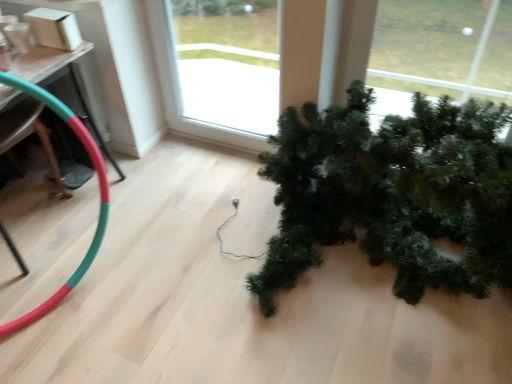
The image size is (512, 384). Describe the element at coordinates (228, 62) in the screenshot. I see `transparent glass window at center` at that location.

The image size is (512, 384). In order to click on green matte christmas tree at lower right in this screenshot , I will do `click(392, 194)`.

This screenshot has height=384, width=512. In order to click on transparent glass window at center in this screenshot , I will do `click(228, 62)`.

From the image's perspective, which one is positioned lower, rubber green and red garden hose at lower left or green matte christmas tree at lower right?

green matte christmas tree at lower right, from the image's perspective.

Is rubber green and red garden hose at lower left positioned beyond the bounds of green matte christmas tree at lower right?

Yes.

Considering the positions of point (56, 112) and point (471, 119), is point (56, 112) closer or farther from the camera than point (471, 119)?

Point (56, 112) is closer to the camera than point (471, 119).

Considering the relative sizes of rubber green and red garden hose at lower left and green matte christmas tree at lower right in the image provided, is rubber green and red garden hose at lower left bigger than green matte christmas tree at lower right?

No.

I want to click on window that appears above the rubber green and red garden hose at lower left (from the image's perspective), so click(x=228, y=62).

In the scene shown: From a real-world perspective, does rubber green and red garden hose at lower left sit lower than transparent glass window at center?

Yes, from a real-world perspective, rubber green and red garden hose at lower left is under transparent glass window at center.

Considering the relative sizes of rubber green and red garden hose at lower left and transparent glass window at center in the image provided, is rubber green and red garden hose at lower left wider than transparent glass window at center?

Yes, rubber green and red garden hose at lower left is wider than transparent glass window at center.

Can we say rubber green and red garden hose at lower left lies outside transparent glass window at center?

Yes.

Considering the positions of objects green matte christmas tree at lower right and transparent glass window at center in the image provided, who is behind, green matte christmas tree at lower right or transparent glass window at center?

transparent glass window at center.

Which object is positioned more to the left, green matte christmas tree at lower right or transparent glass window at center?

From the viewer's perspective, transparent glass window at center appears more on the left side.

Consider the image. Is green matte christmas tree at lower right located outside transparent glass window at center?

Yes, green matte christmas tree at lower right is outside of transparent glass window at center.

Who is bigger, transparent glass window at center or green matte christmas tree at lower right?

With larger size is green matte christmas tree at lower right.

Is transparent glass window at center in front of or behind green matte christmas tree at lower right in the image?

transparent glass window at center is behind green matte christmas tree at lower right.

Is point (199, 23) positioned in front of point (478, 128)?

No, (199, 23) is further to viewer.

From the image's perspective, is green matte christmas tree at lower right located above or below rubber green and red garden hose at lower left?

Clearly, from the image's perspective, green matte christmas tree at lower right is below rubber green and red garden hose at lower left.

In the image, is green matte christmas tree at lower right positioned in front of or behind rubber green and red garden hose at lower left?

Clearly, green matte christmas tree at lower right is in front of rubber green and red garden hose at lower left.

Between green matte christmas tree at lower right and rubber green and red garden hose at lower left, which one has smaller size?

rubber green and red garden hose at lower left is smaller.

Identify the location of window above the rubber green and red garden hose at lower left (from the image's perspective). The width and height of the screenshot is (512, 384). (228, 62).

Relative to rubber green and red garden hose at lower left, is transparent glass window at center in front or behind?

Visually, transparent glass window at center is located behind rubber green and red garden hose at lower left.

Does transparent glass window at center have a lesser width compared to rubber green and red garden hose at lower left?

Yes, transparent glass window at center is thinner than rubber green and red garden hose at lower left.

Does transparent glass window at center have a greater height compared to rubber green and red garden hose at lower left?

Indeed, transparent glass window at center has a greater height compared to rubber green and red garden hose at lower left.

Find the location of a particular element. This screenshot has height=384, width=512. houseplant located in front of the rubber green and red garden hose at lower left is located at coordinates (392, 194).

Locate an element on the screen. window behind the rubber green and red garden hose at lower left is located at coordinates (228, 62).

Which object lies nearer to the anchor point rubber green and red garden hose at lower left, green matte christmas tree at lower right or transparent glass window at center?

green matte christmas tree at lower right is positioned closer to the anchor rubber green and red garden hose at lower left.

Looking at this image, based on their spatial positions, is green matte christmas tree at lower right or rubber green and red garden hose at lower left further from transparent glass window at center?

Among the two, rubber green and red garden hose at lower left is located further to transparent glass window at center.

Looking at the image, which one is located closer to green matte christmas tree at lower right, rubber green and red garden hose at lower left or transparent glass window at center?

transparent glass window at center is closer to green matte christmas tree at lower right.

Based on their spatial positions, is transparent glass window at center or rubber green and red garden hose at lower left closer to green matte christmas tree at lower right?

transparent glass window at center is closer to green matte christmas tree at lower right.

Which object lies further to the anchor point rubber green and red garden hose at lower left, transparent glass window at center or green matte christmas tree at lower right?

Based on the image, transparent glass window at center appears to be further to rubber green and red garden hose at lower left.

Looking at this image, when comparing their distances from transparent glass window at center, does rubber green and red garden hose at lower left or green matte christmas tree at lower right seem further?

rubber green and red garden hose at lower left lies further to transparent glass window at center than the other object.

Where is `window between rubber green and red garden hose at lower left and green matte christmas tree at lower right`? The width and height of the screenshot is (512, 384). window between rubber green and red garden hose at lower left and green matte christmas tree at lower right is located at coordinates (228, 62).